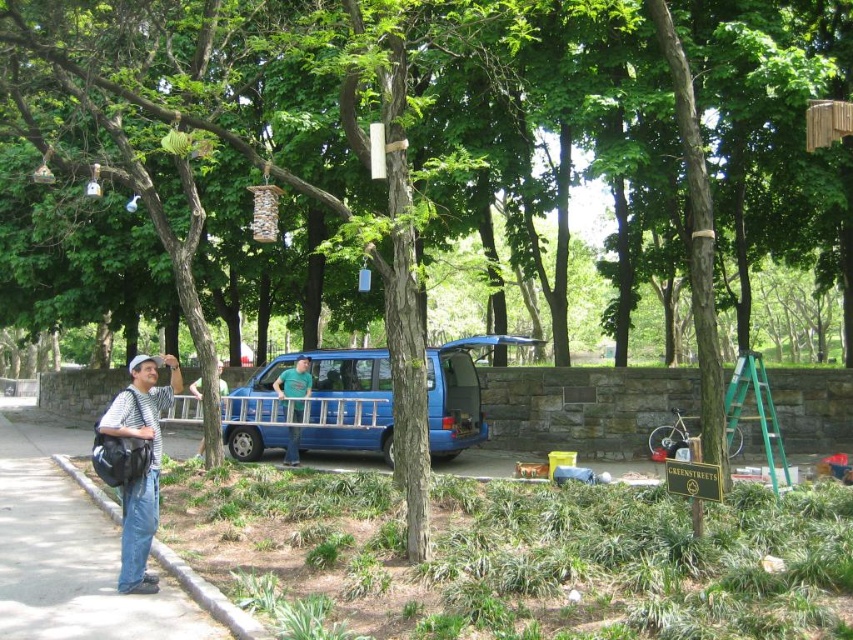
Can you confirm if striped cotton shirt at left is shorter than green cotton shirt at center?

Incorrect, striped cotton shirt at left's height does not fall short of green cotton shirt at center's.

Does point (154, 474) come behind point (289, 452)?

That is False.

Does point (154, 387) come closer to viewer compared to point (291, 413)?

Yes, it is in front of point (291, 413).

The width and height of the screenshot is (853, 640). Find the location of `striped cotton shirt at left`. striped cotton shirt at left is located at coordinates tap(144, 465).

You are a GUI agent. You are given a task and a screenshot of the screen. Output one action in this format:
    pyautogui.click(x=<x>, y=<y>)
    Task: Click on the gray concrete curb at lower left
    This screenshot has height=640, width=853.
    Given the screenshot: What is the action you would take?
    pyautogui.click(x=207, y=595)

Measure the distance between point (180, 561) and camera.

Point (180, 561) and camera are 6.90 meters apart from each other.

Identify the location of gray concrete curb at lower left. (207, 595).

Between point (154, 499) and point (73, 477), which one is positioned in front?

Point (154, 499) is more forward.

At what (x,y) coordinates should I click in order to perform the action: click on striped cotton shirt at left. Please return your answer as a coordinate pair (x, y). This screenshot has height=640, width=853. Looking at the image, I should click on pyautogui.click(x=144, y=465).

Who is more forward, (141, 550) or (178, 561)?

Point (141, 550)

The height and width of the screenshot is (640, 853). What are the coordinates of `striped cotton shirt at left` in the screenshot? It's located at (144, 465).